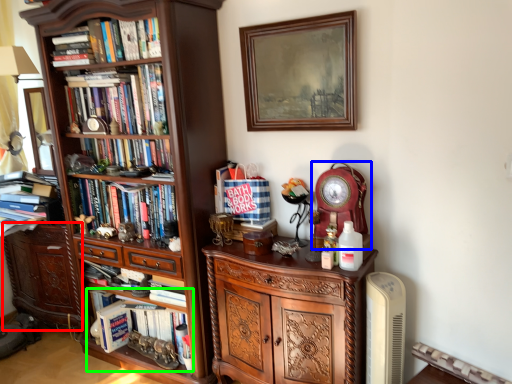
Question: Which object is the farthest from cabinetry (highlighted by a red box)? Choose among these: clock (highlighted by a blue box) or book (highlighted by a green box).

Choices:
 (A) clock
 (B) book

Answer: (A)